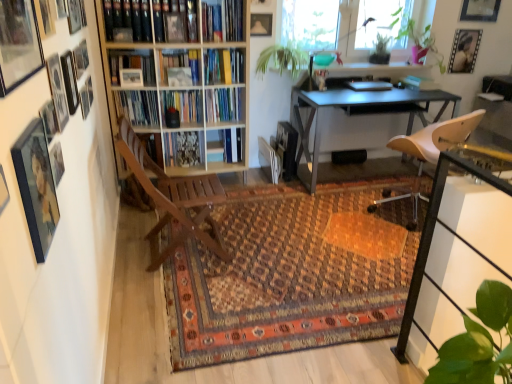
Question: Considering the relative sizes of patterned carpet at center and matte black picture frame at upper left, the seventh picture frame positioned from the front, in the image provided, is patterned carpet at center thinner than matte black picture frame at upper left, the seventh picture frame positioned from the front,?

Choices:
 (A) yes
 (B) no

Answer: (B)

Question: Does patterned carpet at center have a larger size compared to matte black picture frame at upper left, which is the 9th picture frame from back to front?

Choices:
 (A) no
 (B) yes

Answer: (B)

Question: Is patterned carpet at center at the left side of matte black picture frame at upper left, the seventh picture frame positioned from the front?

Choices:
 (A) yes
 (B) no

Answer: (B)

Question: Is patterned carpet at center smaller than matte black picture frame at upper left, placed as the fifth picture frame when sorted from left to right?

Choices:
 (A) no
 (B) yes

Answer: (A)

Question: Can you confirm if patterned carpet at center is taller than matte black picture frame at upper left, the seventh picture frame positioned from the front?

Choices:
 (A) no
 (B) yes

Answer: (A)

Question: From a real-world perspective, is patterned carpet at center located beneath matte black picture frame at upper left, which is the 9th picture frame from back to front?

Choices:
 (A) no
 (B) yes

Answer: (B)

Question: From a real-world perspective, is wooden picture frame at upper left, marked as the 10th picture frame in a front-to-back arrangement, positioned under patterned carpet at center based on gravity?

Choices:
 (A) yes
 (B) no

Answer: (B)

Question: Is wooden picture frame at upper left, the second picture frame from the left, not close to patterned carpet at center?

Choices:
 (A) no
 (B) yes

Answer: (B)

Question: Is wooden picture frame at upper left, marked as the 10th picture frame in a front-to-back arrangement, turned away from patterned carpet at center?

Choices:
 (A) yes
 (B) no

Answer: (B)

Question: From the image's perspective, is wooden picture frame at upper left, marked as the 10th picture frame in a front-to-back arrangement, located above patterned carpet at center?

Choices:
 (A) yes
 (B) no

Answer: (A)

Question: Considering the relative sizes of wooden picture frame at upper left, the second picture frame from the left, and patterned carpet at center in the image provided, is wooden picture frame at upper left, the second picture frame from the left, thinner than patterned carpet at center?

Choices:
 (A) no
 (B) yes

Answer: (B)

Question: Is wooden picture frame at upper left, marked as the 10th picture frame in a front-to-back arrangement, completely or partially outside of patterned carpet at center?

Choices:
 (A) no
 (B) yes

Answer: (B)

Question: Is transparent glass window screen at upper center smaller than metallic gray desk at center?

Choices:
 (A) no
 (B) yes

Answer: (B)